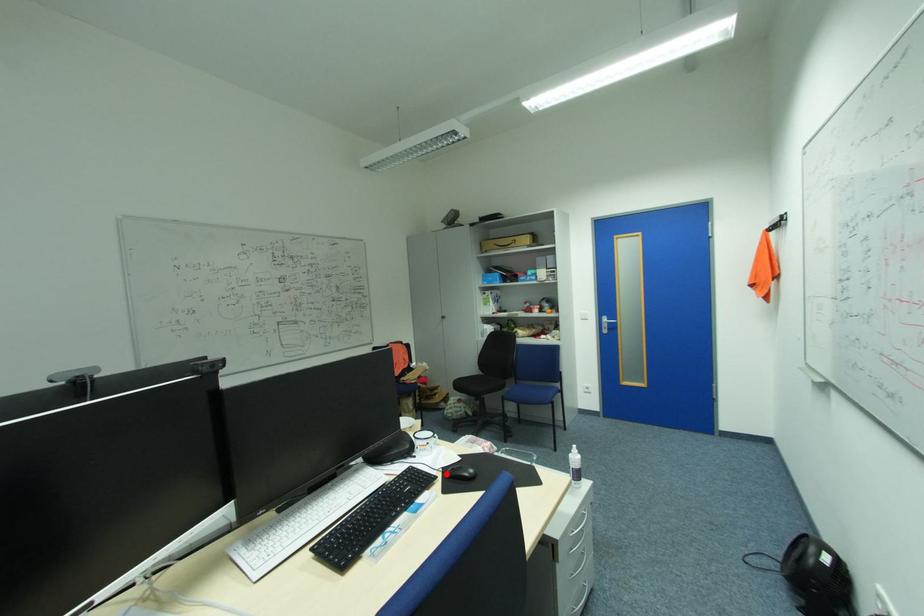
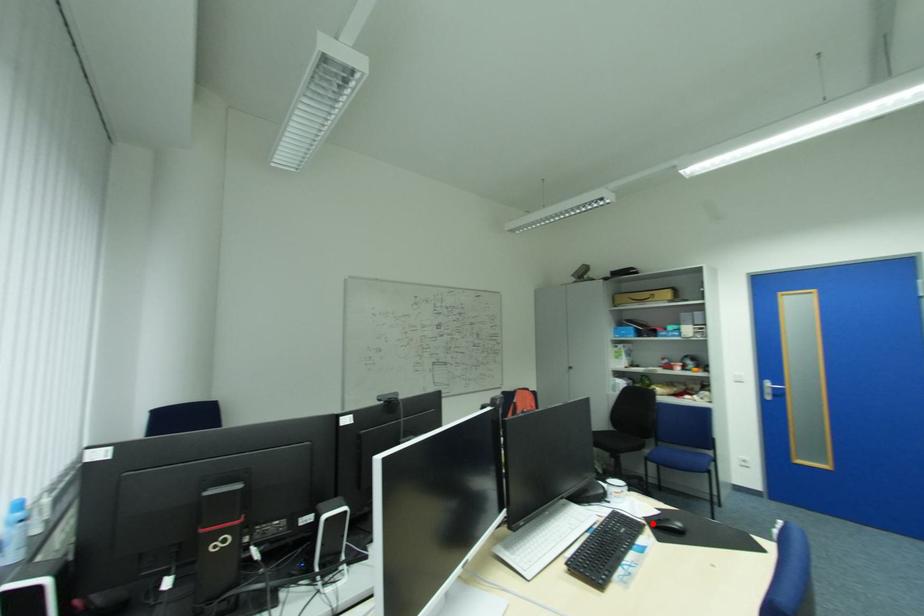
I am providing you with two images of the same scene from different viewpoints. A red point is marked on the first image and another point is marked on the second image. Are the points marked in image1 and image2 representing the same 3D position?

Yes